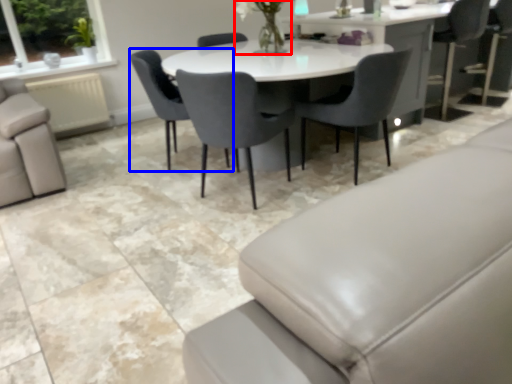
Question: Which of the following is the closest to the observer, floral arrangement (highlighted by a red box) or chair (highlighted by a blue box)?

Choices:
 (A) floral arrangement
 (B) chair

Answer: (A)